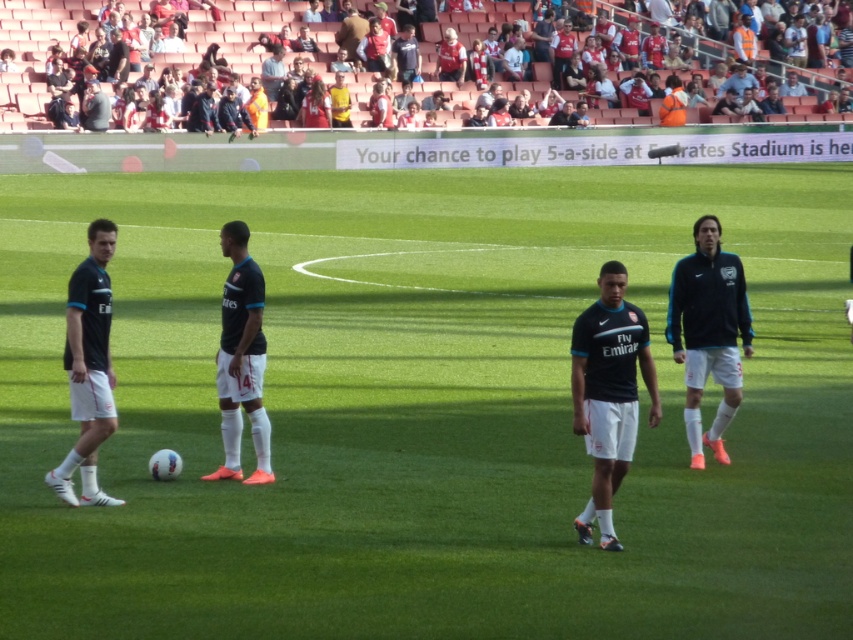
Which is in front, point (592, 353) or point (236, 225)?

Point (592, 353) is in front.

In the scene shown: Is matte black jersey at center shorter than black matte jersey at center?

Indeed, matte black jersey at center has a lesser height compared to black matte jersey at center.

Who is more distant from viewer, (631, 330) or (242, 372)?

The point (242, 372) is more distant.

The height and width of the screenshot is (640, 853). I want to click on matte black jersey at center, so pyautogui.click(x=608, y=392).

Consider the image. Is black jersey at upper center bigger than black matte jersey at left?

Correct, black jersey at upper center is larger in size than black matte jersey at left.

In the scene shown: Which is below, black jersey at upper center or black matte jersey at left?

black matte jersey at left is lower down.

The width and height of the screenshot is (853, 640). In order to click on black jersey at upper center in this screenshot , I will do `click(230, 35)`.

Is black matte jersey at center below dark gray jacket at upper left?

Yes.

Measure the distance between black matte jersey at center and camera.

black matte jersey at center and camera are 11.32 meters apart from each other.

Find the location of `black matte jersey at center`. black matte jersey at center is located at coordinates (241, 356).